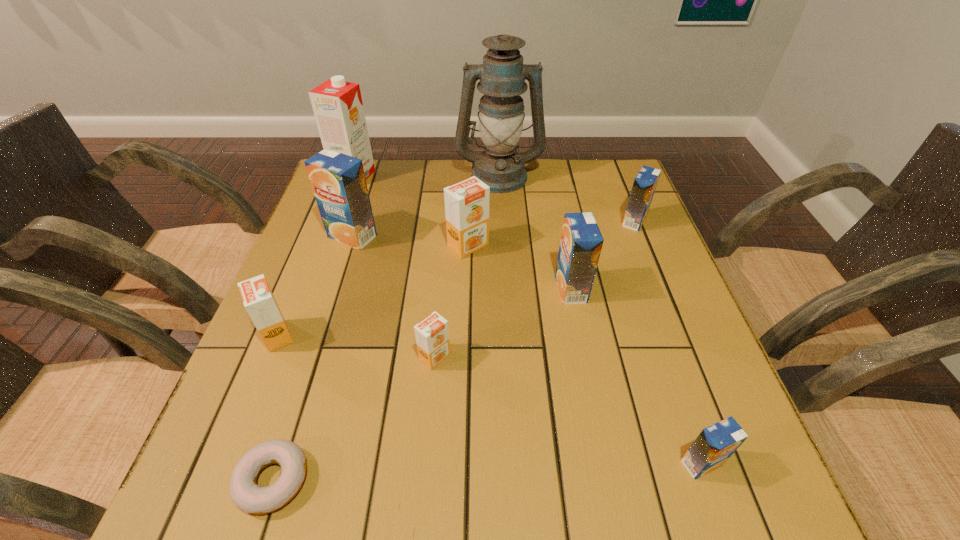
Identify the location of object that is at the far left corner. (338, 108).

The width and height of the screenshot is (960, 540). I want to click on object at the near left corner, so click(249, 497).

This screenshot has width=960, height=540. I want to click on object located in the near right corner section of the desktop, so pyautogui.click(x=716, y=443).

Locate an element on the screen. The height and width of the screenshot is (540, 960). vacant space at the far edge is located at coordinates (458, 174).

The image size is (960, 540). What are the coordinates of `vacant space at the near edge` in the screenshot? It's located at (600, 494).

You are a GUI agent. You are given a task and a screenshot of the screen. Output one action in this format:
    pyautogui.click(x=<x>, y=<y>)
    Task: Click on the vacant space at the left edge
    The height and width of the screenshot is (540, 960).
    Given the screenshot: What is the action you would take?
    pyautogui.click(x=320, y=247)

In order to click on vacant area at the right edge of the desktop in this screenshot , I will do `click(661, 285)`.

Locate an element on the screen. vacant space at the far left corner is located at coordinates (368, 184).

The width and height of the screenshot is (960, 540). I want to click on free space at the near left corner of the desktop, so pos(212,486).

Locate an element on the screen. This screenshot has width=960, height=540. vacant space at the far right corner of the desktop is located at coordinates (606, 196).